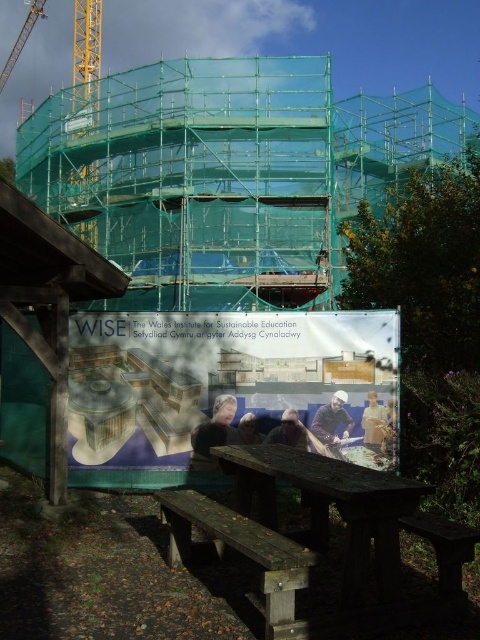
You are a construction worker standing at the picnic table and want to reach both the light brown wooden bench at center and the smooth brown hair at center. Which object is closer to you?

The light brown wooden bench at center is closer to you than the smooth brown hair at center.

You are a construction worker standing at the wooden bench at lower right. You need to retrieve your dark blue sweater at center to keep warm. Which direction should you move to reach it?

The dark blue sweater at center is to the left of the wooden bench at lower right, so you should move to the left to reach it.

You are standing at the point labeled as point (338, 508) in the construction site image. What object are you currently standing on?

The point (338, 508) indicates the wooden picnic table at lower center, so you are standing on the wooden picnic table at lower center.